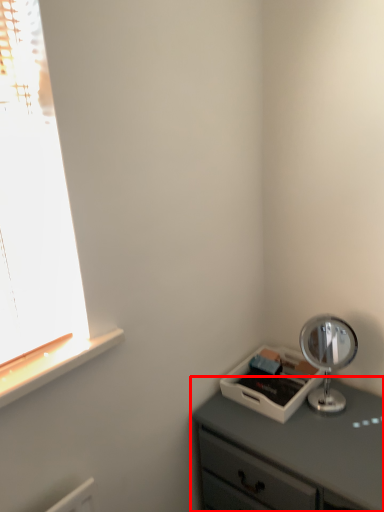
Question: Where is chest of drawers (annotated by the red box) located in relation to table lamp in the image?

Choices:
 (A) left
 (B) right

Answer: (A)